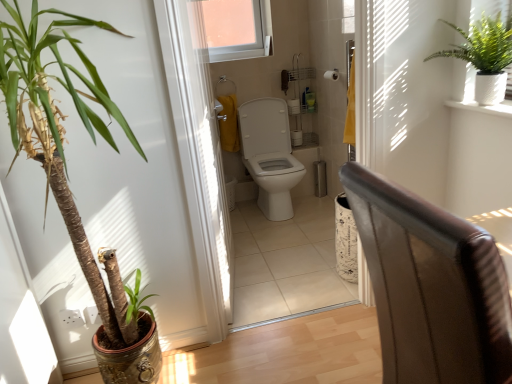
Question: Is white glossy toilet at center outside of green textured plant at upper right, the first houseplant positioned from the right?

Choices:
 (A) yes
 (B) no

Answer: (A)

Question: Is white glossy toilet at center far away from green textured plant at upper right, the 2th houseplant positioned from the left?

Choices:
 (A) yes
 (B) no

Answer: (A)

Question: Considering the relative positions of white glossy toilet at center and green textured plant at upper right, the 2th houseplant positioned from the left, in the image provided, is white glossy toilet at center behind green textured plant at upper right, the 2th houseplant positioned from the left,?

Choices:
 (A) yes
 (B) no

Answer: (A)

Question: Considering the relative positions of white glossy toilet at center and green textured plant at upper right, the first houseplant positioned from the right, in the image provided, is white glossy toilet at center to the right of green textured plant at upper right, the first houseplant positioned from the right, from the viewer's perspective?

Choices:
 (A) no
 (B) yes

Answer: (A)

Question: Considering the relative sizes of white glossy toilet at center and green textured plant at upper right, the first houseplant positioned from the right, in the image provided, is white glossy toilet at center shorter than green textured plant at upper right, the first houseplant positioned from the right,?

Choices:
 (A) no
 (B) yes

Answer: (A)

Question: From the image's perspective, is leather armchair at right positioned above or below clear glass window at upper center?

Choices:
 (A) above
 (B) below

Answer: (B)

Question: In the image, is leather armchair at right positioned in front of or behind clear glass window at upper center?

Choices:
 (A) front
 (B) behind

Answer: (A)

Question: From their relative heights in the image, would you say leather armchair at right is taller or shorter than clear glass window at upper center?

Choices:
 (A) short
 (B) tall

Answer: (B)

Question: From a real-world perspective, is leather armchair at right physically located above or below clear glass window at upper center?

Choices:
 (A) below
 (B) above

Answer: (A)

Question: Considering their positions, is leather armchair at right located in front of or behind white glossy toilet at center?

Choices:
 (A) behind
 (B) front

Answer: (B)

Question: From their relative heights in the image, would you say leather armchair at right is taller or shorter than white glossy toilet at center?

Choices:
 (A) tall
 (B) short

Answer: (A)

Question: Considering the positions of point (484, 375) and point (268, 162), is point (484, 375) closer or farther from the camera than point (268, 162)?

Choices:
 (A) farther
 (B) closer

Answer: (B)

Question: Would you say leather armchair at right is inside or outside white glossy toilet at center?

Choices:
 (A) outside
 (B) inside

Answer: (A)

Question: Is point (202, 205) closer or farther from the camera than point (355, 167)?

Choices:
 (A) farther
 (B) closer

Answer: (A)

Question: Would you say white plastic screen door at center is inside or outside leather armchair at right?

Choices:
 (A) outside
 (B) inside

Answer: (A)